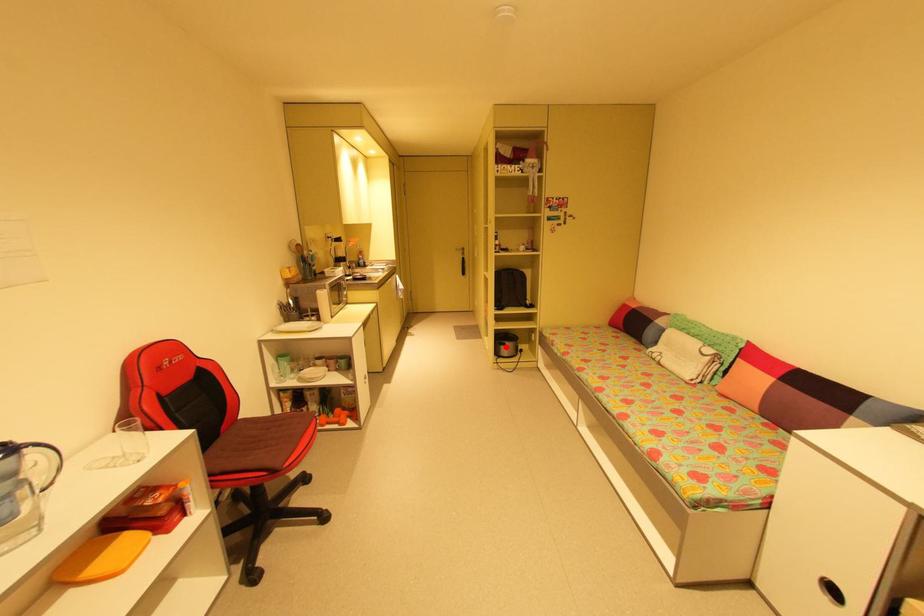
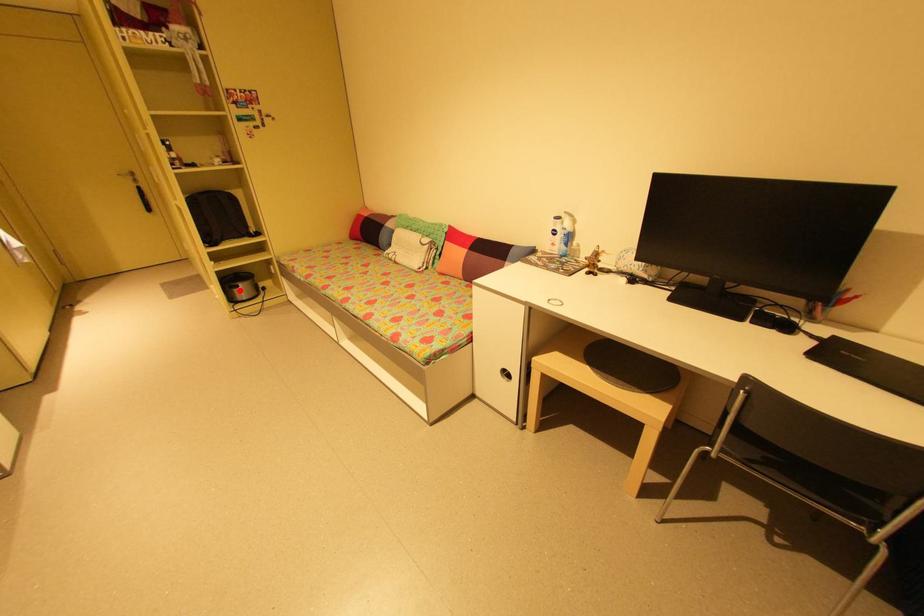
I am providing you with two images of the same scene from different viewpoints. A red point is marked on the first image and another point is marked on the second image. Do the highlighted points in image1 and image2 indicate the same real-world spot?

Yes